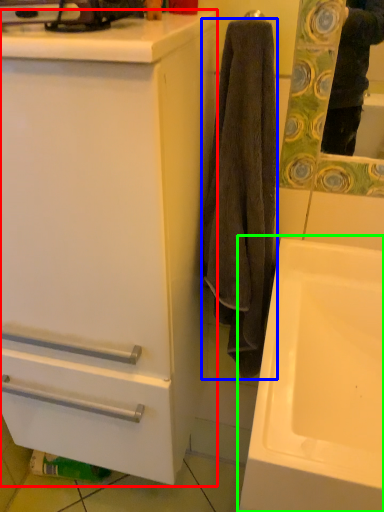
Question: Which object is positioned farthest from bathroom cabinet (highlighted by a red box)? Select from towel/napkin (highlighted by a blue box) and sink (highlighted by a green box).

Choices:
 (A) towel/napkin
 (B) sink

Answer: (B)